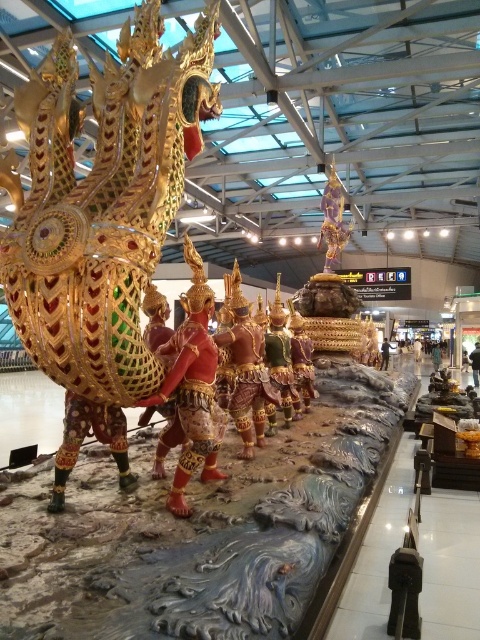
Question: Does gold textured statue at center appear over green fabric person at center?

Choices:
 (A) no
 (B) yes

Answer: (B)

Question: Which point is farther to the camera?

Choices:
 (A) green fabric person at center
 (B) gold textured statue at center
 (C) white matte person at center
 (D) gold metallic dragon at center

Answer: (C)

Question: Which of these objects is positioned farthest from the gold metallic dragon at center?

Choices:
 (A) matte gold armor at center
 (B) gold textured statue at center

Answer: (B)

Question: Estimate the real-world distances between objects in this image. Which object is farther from the dark brown leather jacket at lower right?

Choices:
 (A) smooth gold statue at center
 (B) gold textured statue at center

Answer: (B)

Question: Is gold textured statue at center to the right of dark brown leather jacket at lower right from the viewer's perspective?

Choices:
 (A) yes
 (B) no

Answer: (B)

Question: Can you confirm if gold metallic dragon at center is smaller than green fabric person at center?

Choices:
 (A) no
 (B) yes

Answer: (A)